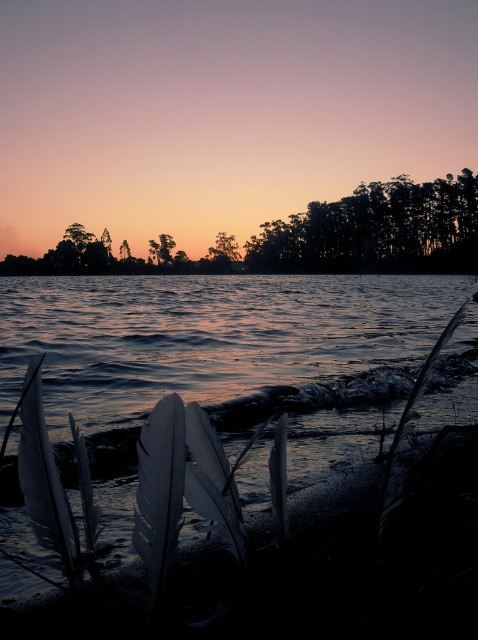
You are an artist trying to sketch the sunset scene. You want to place the dark green leafy trees at upper center accurately. According to the coordinates provided, where should you position them on your canvas?

The dark green leafy trees at upper center should be positioned at coordinates point [378,230].